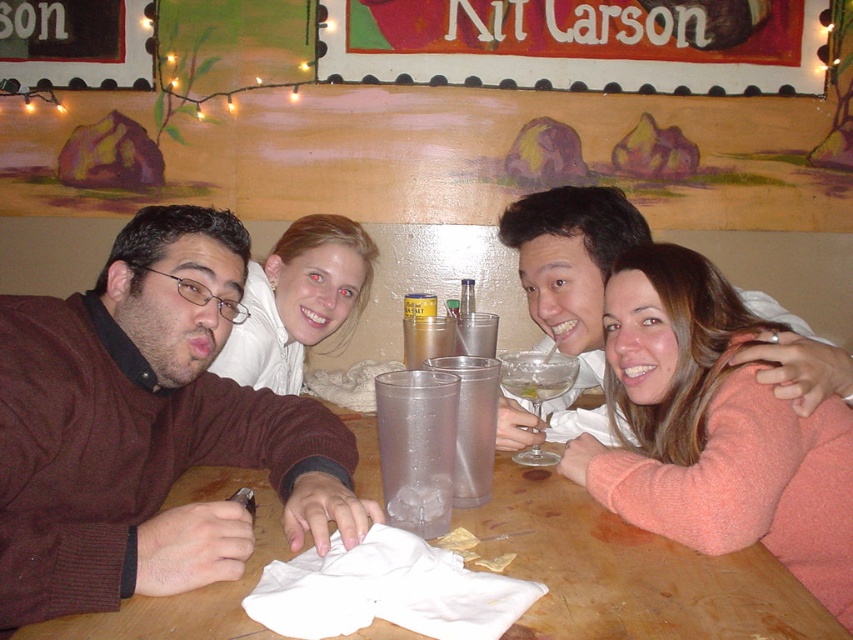
Question: Is brown sweater at left bigger than translucent glass at center?

Choices:
 (A) no
 (B) yes

Answer: (B)

Question: Based on their relative distances, which object is nearer to the wooden table at center?

Choices:
 (A) clear plastic cup at table center
 (B) smooth white blouse at upper center

Answer: (A)

Question: Among these points, which one is farthest from the camera?

Choices:
 (A) (405, 397)
 (B) (303, 291)
 (C) (345, 518)
 (D) (492, 541)

Answer: (B)

Question: Which object is the farthest from the clear glass at center?

Choices:
 (A) clear plastic cup at table center
 (B) translucent glass at center

Answer: (A)

Question: Is clear plastic cup at table center behind clear glass at center?

Choices:
 (A) yes
 (B) no

Answer: (B)

Question: Does smooth white blouse at upper center appear over clear glass at center?

Choices:
 (A) yes
 (B) no

Answer: (A)